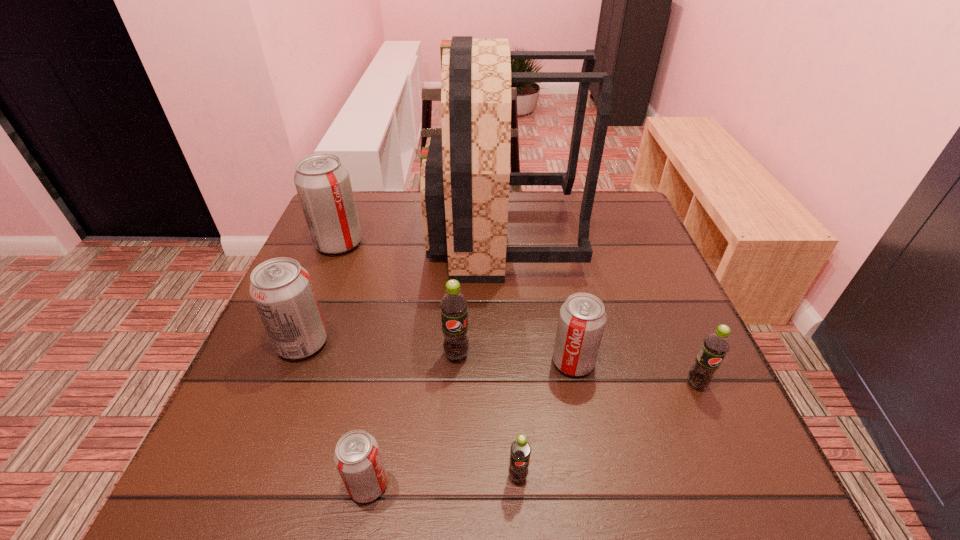
Locate an element on the screen. free region that satisfies the following two spatial constraints: 1. on the front face of the tallest object; 2. on the back side of the second smallest gray soda can is located at coordinates 510,362.